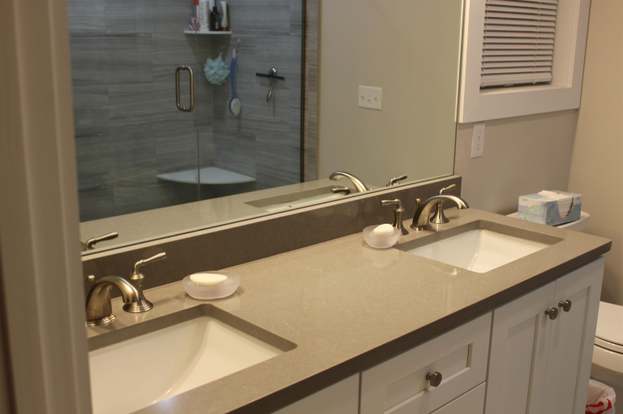
The height and width of the screenshot is (414, 623). Find the location of `tissue box`. tissue box is located at coordinates [x=531, y=209].